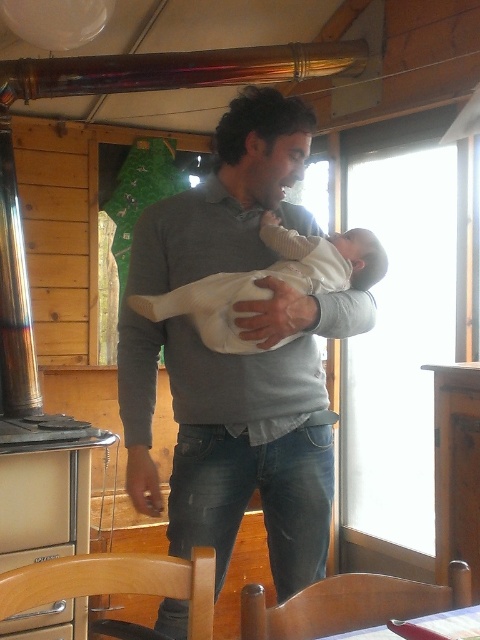
Question: Which of the following is the closest to the observer?

Choices:
 (A) (156, 296)
 (B) (212, 378)

Answer: (A)

Question: Is gray cotton sweater at center behind wooden dining table at center?

Choices:
 (A) no
 (B) yes

Answer: (B)

Question: Which point appears farthest from the camera in this image?

Choices:
 (A) (9, 433)
 (B) (477, 627)
 (C) (182, 348)

Answer: (A)

Question: Where is gray cotton sweater at center located in relation to white soft baby at center in the image?

Choices:
 (A) left
 (B) right

Answer: (A)

Question: Can you confirm if gray cotton sweater at center is smaller than metallic gray oven at lower left?

Choices:
 (A) no
 (B) yes

Answer: (A)

Question: Which object is the closest to the wooden dining table at center?

Choices:
 (A) metallic gray oven at lower left
 (B) gray cotton sweater at center
 (C) white soft baby at center

Answer: (B)